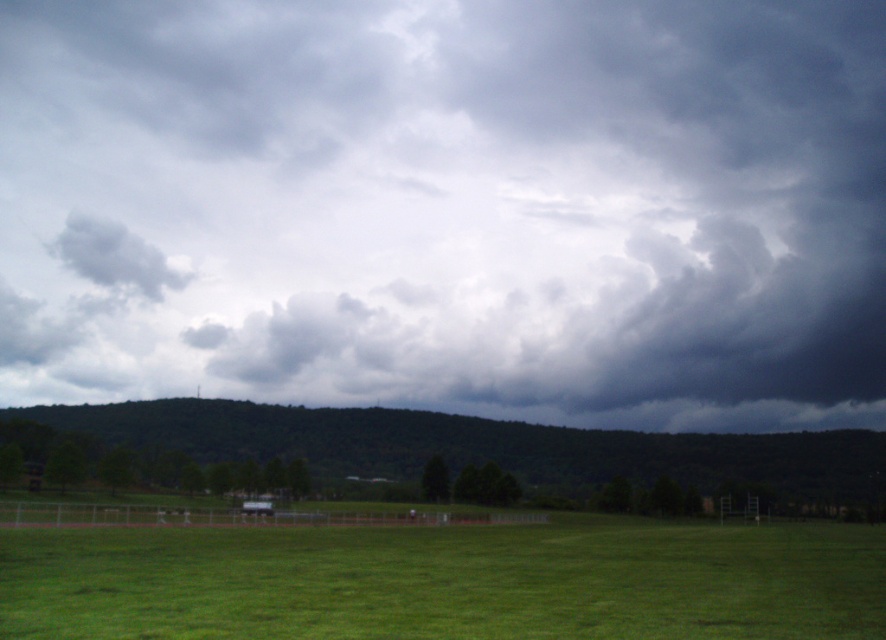
Question: Considering the real-world distances, which object is closest to the green grassy field at lower center?

Choices:
 (A) green grass at lower center
 (B) gray fluffy cloud at upper left

Answer: (A)

Question: Which of these objects is positioned farthest from the dark gray cloud at center?

Choices:
 (A) green grassy field at lower center
 (B) gray fluffy cloud at upper left
 (C) green grass at lower center

Answer: (A)

Question: Can you confirm if dark gray cloud at center is positioned above green grassy field at lower center?

Choices:
 (A) yes
 (B) no

Answer: (A)

Question: Which point is closer to the camera?

Choices:
 (A) (323, 211)
 (B) (109, 278)
 (C) (63, 412)
 (D) (739, 582)

Answer: (D)

Question: Is dark gray cloud at center further to the viewer compared to gray fluffy cloud at upper left?

Choices:
 (A) no
 (B) yes

Answer: (A)

Question: Does green grass at lower center have a larger size compared to gray fluffy cloud at upper left?

Choices:
 (A) no
 (B) yes

Answer: (B)